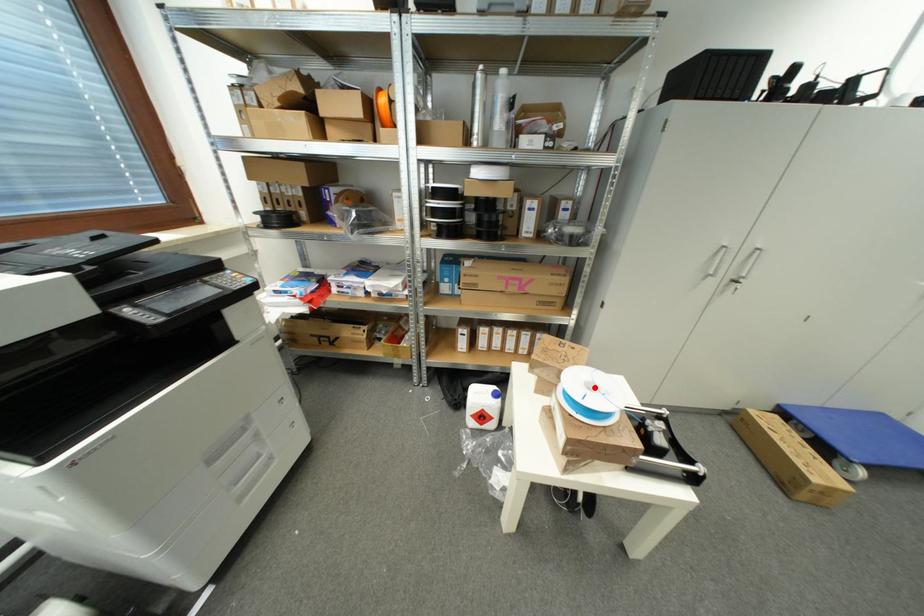
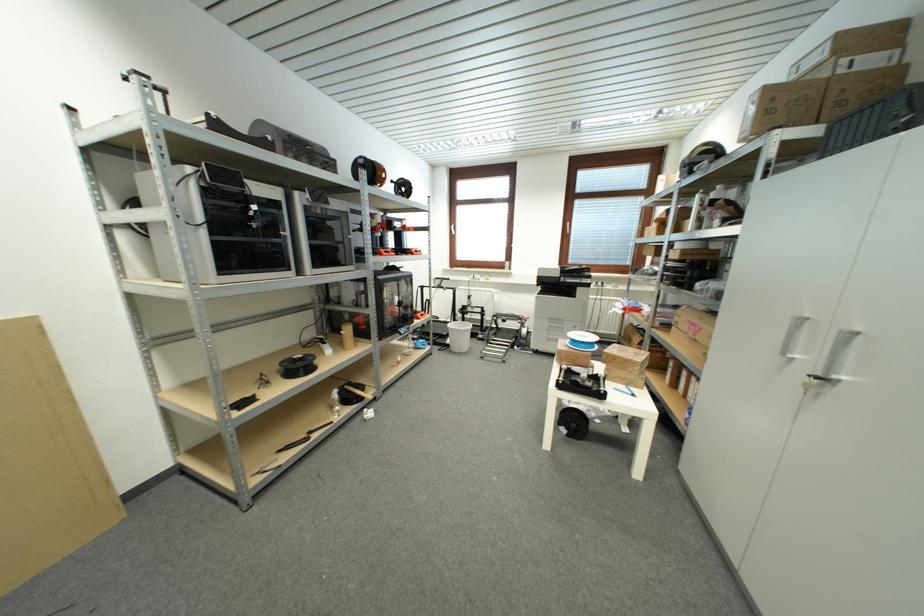
Find the pixel in the second image that matches the highlighted location in the first image.

(590, 339)